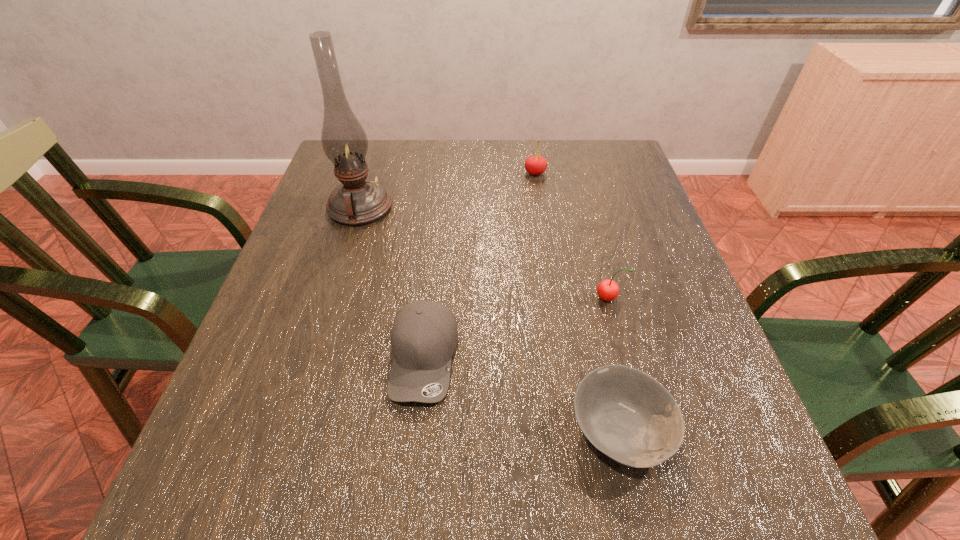
Locate an element on the screen. blank area in the image that satisfies the following two spatial constraints: 1. on the front brim of the shortest object; 2. on the right side of the fourth object from right to left is located at coordinates (417, 429).

Find the location of `vacant region that satisfies the following two spatial constraints: 1. on the front brim of the shortest object; 2. on the right side of the baseball cap`. vacant region that satisfies the following two spatial constraints: 1. on the front brim of the shortest object; 2. on the right side of the baseball cap is located at coordinates (417, 429).